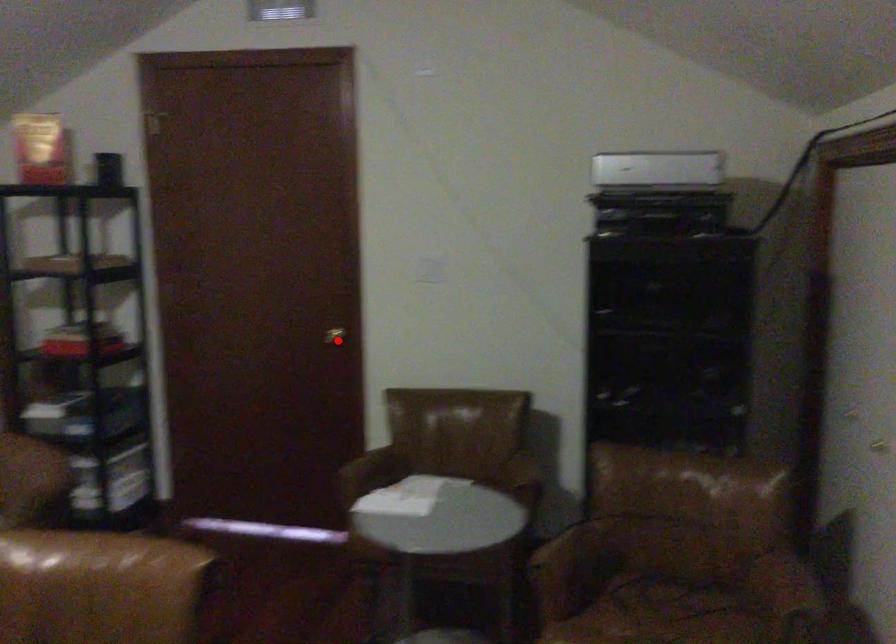
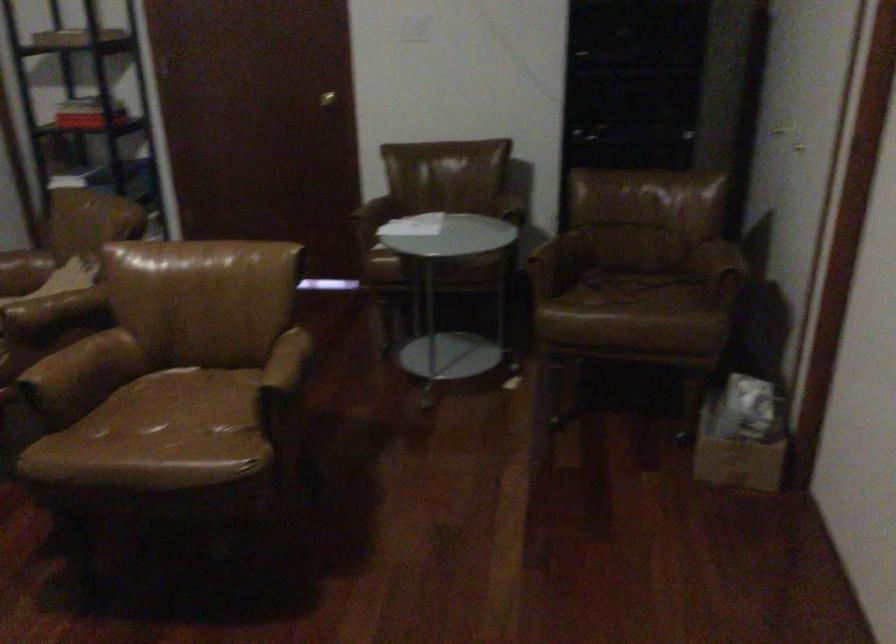
The point at the highlighted location is marked in the first image. Where is the corresponding point in the second image?

(326, 99)